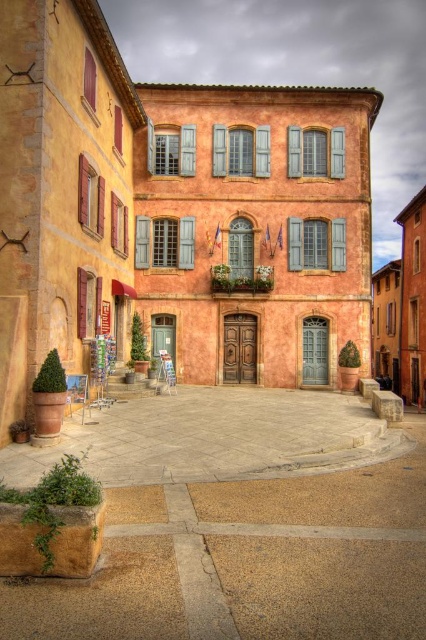
Between wooden shutter at left and blue wood shutter at upper left, which one appears on the right side from the viewer's perspective?

Positioned to the right is wooden shutter at left.

Between wooden shutter at left and blue wood shutter at upper left, which one has less height?

blue wood shutter at upper left is shorter.

Who is more distant from viewer, (x=141, y=250) or (x=114, y=138)?

The point (x=141, y=250) is behind.

Identify the location of wooden shutter at left. The width and height of the screenshot is (426, 640). (141, 241).

Is blue wood shutters at center closer to the viewer compared to matte wood shutter at left?

No, blue wood shutters at center is behind matte wood shutter at left.

Is point (242, 163) farther from viewer compared to point (100, 179)?

Yes, point (242, 163) is farther from viewer.

Identify the location of blue wood shutters at center. This screenshot has width=426, height=640. (241, 150).

Image resolution: width=426 pixels, height=640 pixels. Describe the element at coordinates (164, 243) in the screenshot. I see `wooden shutters at center` at that location.

Does wooden shutters at center come in front of wooden shutters at left?

That is False.

Is point (178, 266) positioned behind point (123, 208)?

That is True.

At what (x,y) coordinates should I click in order to perform the action: click on wooden shutters at center. Please return your answer as a coordinate pair (x, y). This screenshot has height=640, width=426. Looking at the image, I should click on (164, 243).